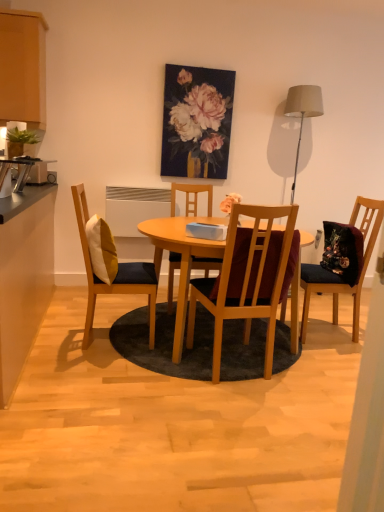
You are a GUI agent. You are given a task and a screenshot of the screen. Output one action in this format:
    pyautogui.click(x=<x>, y=<y>)
    Task: Click on the free location in front of yellow and white cushioned chair at left, which appears as the 1th chair when viewed from the left
    This screenshot has width=384, height=512.
    Given the screenshot: What is the action you would take?
    point(90,368)